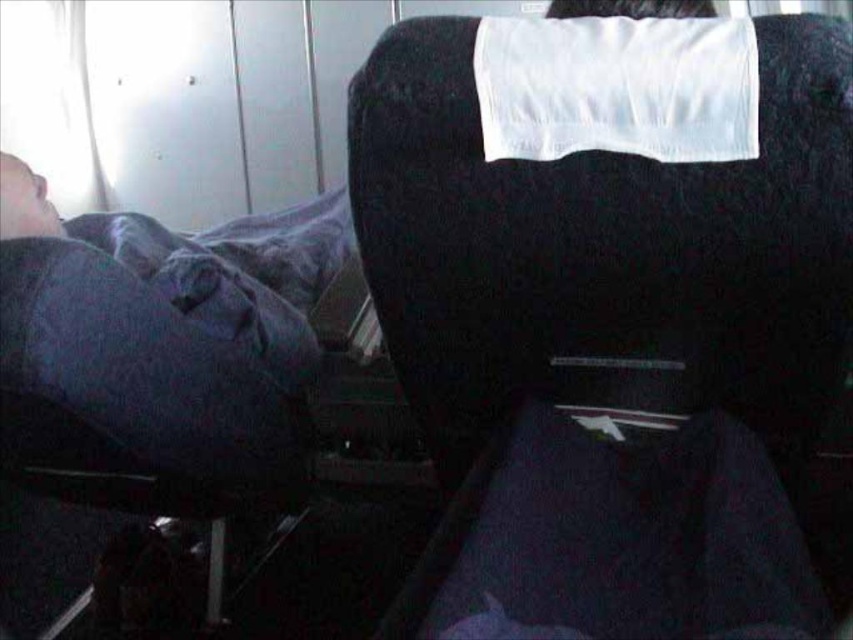
Does black fabric chair at upper right appear on the right side of dark blue fabric at left?

Indeed, black fabric chair at upper right is positioned on the right side of dark blue fabric at left.

Who is more distant from viewer, (567, 84) or (218, 353)?

Positioned behind is point (218, 353).

You are a GUI agent. You are given a task and a screenshot of the screen. Output one action in this format:
    pyautogui.click(x=<x>, y=<y>)
    Task: Click on the black fabric chair at upper right
    The image size is (853, 640).
    Given the screenshot: What is the action you would take?
    pyautogui.click(x=619, y=234)